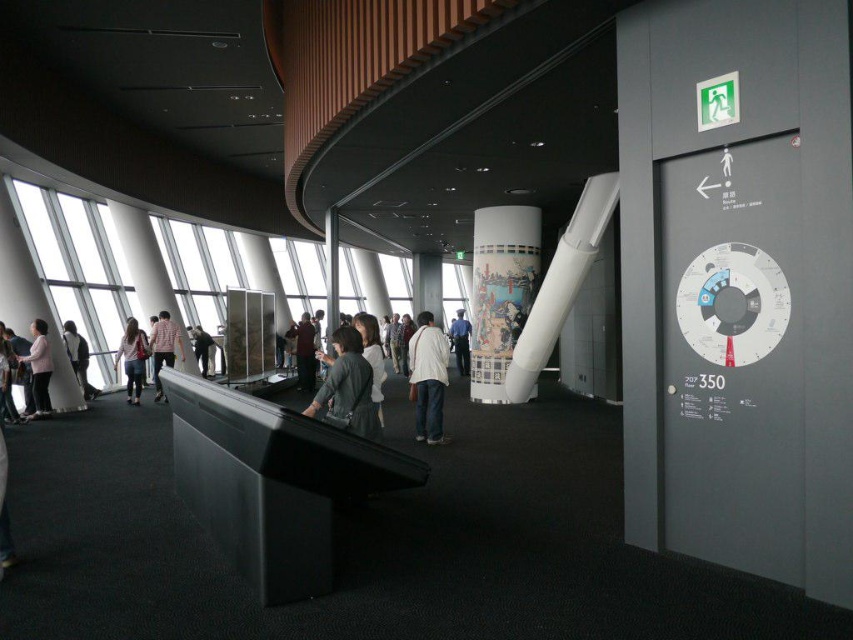
Does dark gray fabric jacket at center have a larger size compared to dark gray jacket at left?

Incorrect, dark gray fabric jacket at center is not larger than dark gray jacket at left.

Which is above, dark gray fabric jacket at center or dark gray jacket at left?

Positioned higher is dark gray fabric jacket at center.

The height and width of the screenshot is (640, 853). What do you see at coordinates (347, 387) in the screenshot?
I see `dark gray fabric jacket at center` at bounding box center [347, 387].

Find the location of a particular element. This screenshot has width=853, height=640. dark gray fabric jacket at center is located at coordinates (347, 387).

Does white matte jacket at center have a larger size compared to denim pants at left?

No.

Which is below, white matte jacket at center or denim pants at left?

denim pants at left

This screenshot has height=640, width=853. What do you see at coordinates (427, 378) in the screenshot? I see `white matte jacket at center` at bounding box center [427, 378].

Locate an element on the screen. This screenshot has width=853, height=640. white matte jacket at center is located at coordinates (427, 378).

Can you confirm if white fabric jacket at center is positioned to the right of dark gray jacket at center?

Yes, white fabric jacket at center is to the right of dark gray jacket at center.

Does point (369, 316) come behind point (193, 352)?

No, it is in front of (193, 352).

Where is `white fabric jacket at center`? The width and height of the screenshot is (853, 640). white fabric jacket at center is located at coordinates (372, 356).